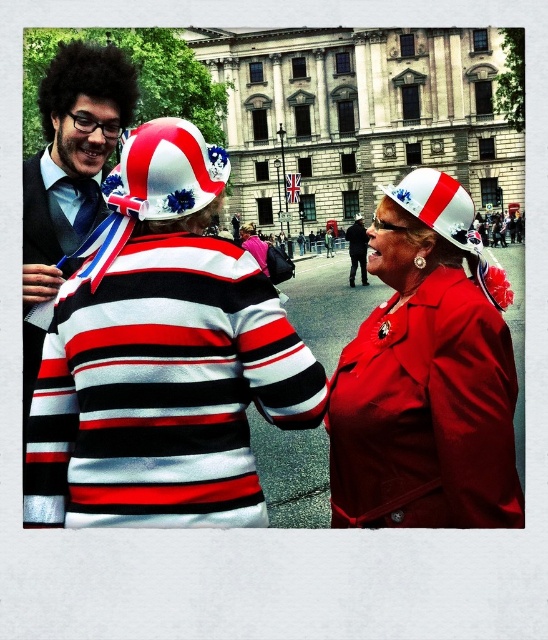
You are a photographer trying to capture a photo of both the matte red coat at center and the white fabric hat at upper center. Since you want them both in the frame, which object should you position closer to the left side of your camera viewfinder?

The white fabric hat at upper center should be positioned closer to the left side of the camera viewfinder because the matte red coat at center is to the right of it.

You are a photographer wanting to capture both the white and red fabric hat at center and the dark blue suit at center in a single frame. Given their sizes, which object should you focus on to ensure both are clearly visible in the photo?

The white and red fabric hat at center has a larger size compared to dark blue suit at center. To ensure both are clearly visible, focus on the white and red fabric hat at center since it is larger and will be easier to capture in the frame without missing details.

You are a photographer standing at the corner of the street. You want to take a photo of the matte red coat at center. Where should you position yourself to capture it in the best possible frame?

The matte red coat at center is located at point (425, 378), so you should position yourself directly in front of that coordinate to capture it in the best possible frame.